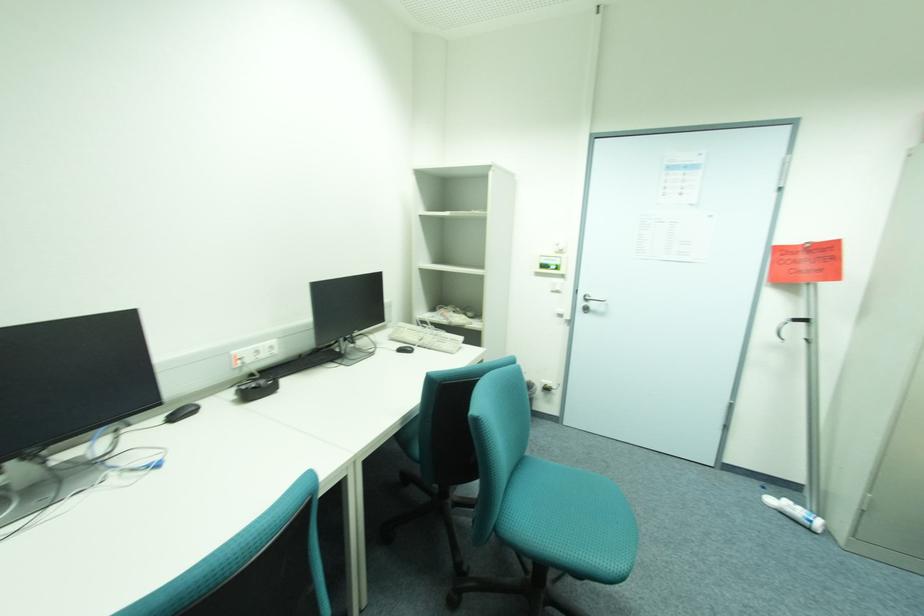
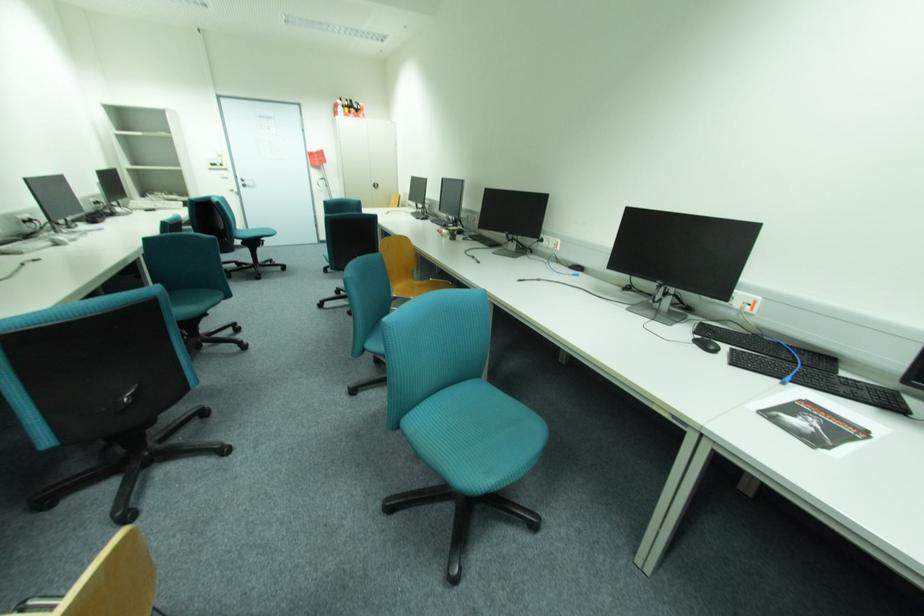
Locate, in the second image, the point that corresponds to point 600,305 in the first image.

(253, 183)